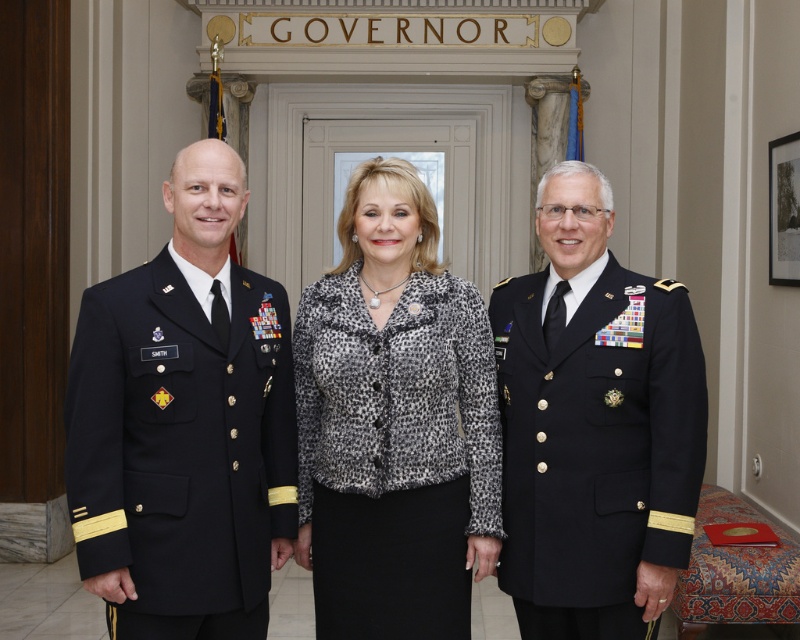
Does point (102, 541) come behind point (536, 545)?

That is False.

Is point (180, 602) more distant than point (512, 484)?

No, it is not.

The height and width of the screenshot is (640, 800). In order to click on navy blue fabric military uniform at left in this screenshot , I will do 182,448.

Which is below, leopard print blouse at center or dark blue wool military uniform at right?

dark blue wool military uniform at right

What do you see at coordinates (276, 428) in the screenshot? This screenshot has width=800, height=640. I see `leopard print blouse at center` at bounding box center [276, 428].

Is point (484, 550) positioned in front of point (560, 515)?

No, (484, 550) is behind (560, 515).

Find the location of `leopard print blouse at center`. leopard print blouse at center is located at coordinates (276, 428).

Can you confirm if leopard print blouse at center is positioned above navy blue fabric military uniform at left?

Indeed, leopard print blouse at center is positioned over navy blue fabric military uniform at left.

Based on the photo, can you confirm if leopard print blouse at center is positioned to the right of navy blue fabric military uniform at left?

Correct, you'll find leopard print blouse at center to the right of navy blue fabric military uniform at left.

Is point (152, 582) positioned behind point (150, 358)?

That is False.

Identify the location of leopard print blouse at center. This screenshot has height=640, width=800. (276, 428).